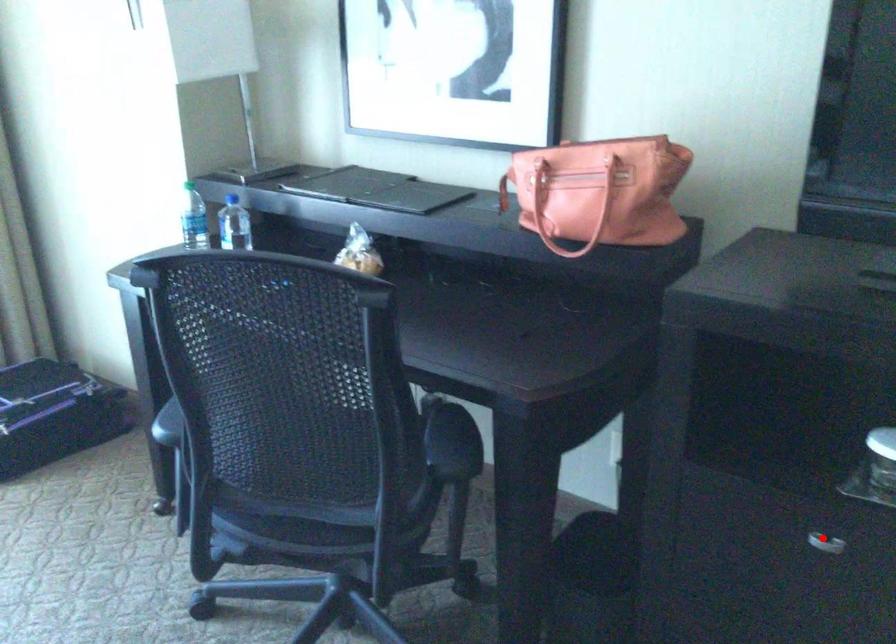
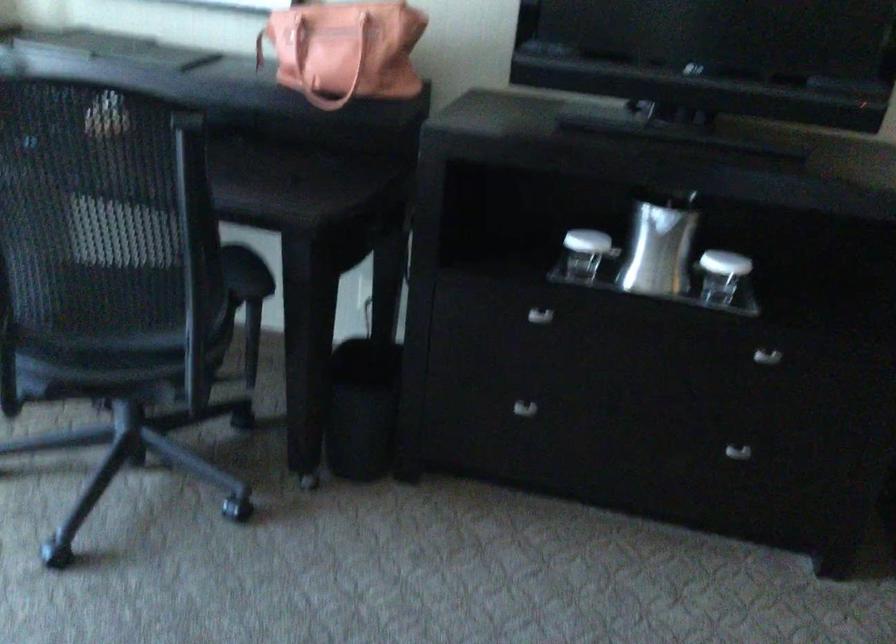
Question: I am providing you with two images of the same scene from different viewpoints. Given a red point in image1, look at the same physical point in image2. Is it:

Choices:
 (A) Closer to the viewpoint
 (B) Farther from the viewpoint

Answer: (B)